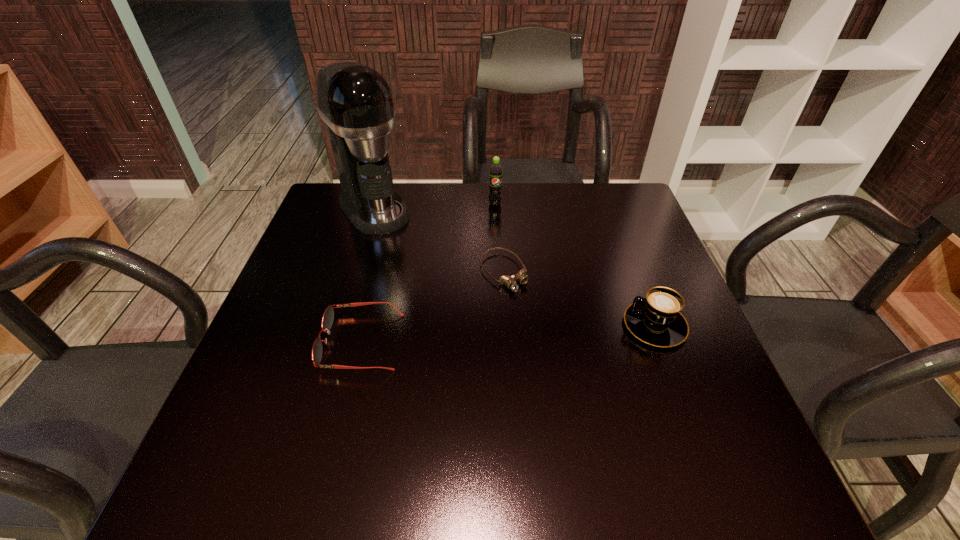
Where is `vacant space at the far left corner of the desktop`? The height and width of the screenshot is (540, 960). vacant space at the far left corner of the desktop is located at coordinates (346, 228).

This screenshot has width=960, height=540. I want to click on free region at the far right corner of the desktop, so click(x=624, y=218).

Locate an element on the screen. The width and height of the screenshot is (960, 540). free space that is in between the rightmost object and the tallest object is located at coordinates point(515,267).

Image resolution: width=960 pixels, height=540 pixels. I want to click on free spot between the tallest object and the soda, so click(435, 206).

This screenshot has width=960, height=540. I want to click on vacant area between the spectacles and the rightmost object, so click(x=508, y=333).

The width and height of the screenshot is (960, 540). Find the location of `free space between the shortest object and the second shortest object`. free space between the shortest object and the second shortest object is located at coordinates (432, 307).

Locate an element on the screen. free space between the tallest object and the second shortest object is located at coordinates (368, 275).

Identify the location of vacant space in between the fourth shortest object and the cappuccino. Image resolution: width=960 pixels, height=540 pixels. (575, 265).

Locate an element on the screen. This screenshot has height=540, width=960. free spot between the rightmost object and the fourth tallest object is located at coordinates (508, 333).

At what (x,y) coordinates should I click in order to perform the action: click on unoccupied position between the cappuccino and the third farthest object. Please return your answer as a coordinate pair (x, y). The image size is (960, 540). Looking at the image, I should click on (579, 299).